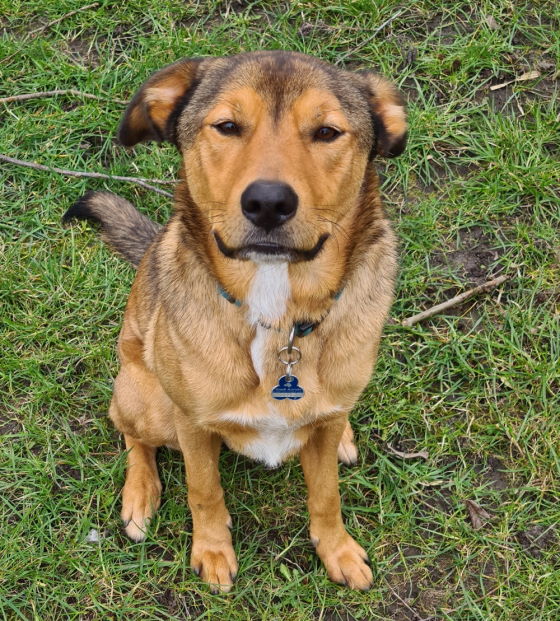
Where is `white fur`? The width and height of the screenshot is (560, 621). white fur is located at coordinates (260, 443), (272, 284), (260, 361), (346, 458), (137, 528).